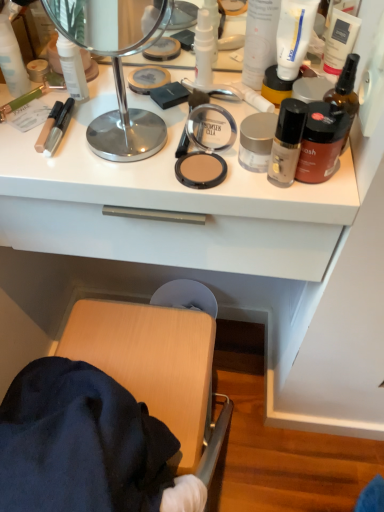
Image resolution: width=384 pixels, height=512 pixels. Identify the location of free space between polished silver mirror at upper center and matte white lotion at upper left, which is counted as the tenth toiletry, starting from the right. (71, 114).